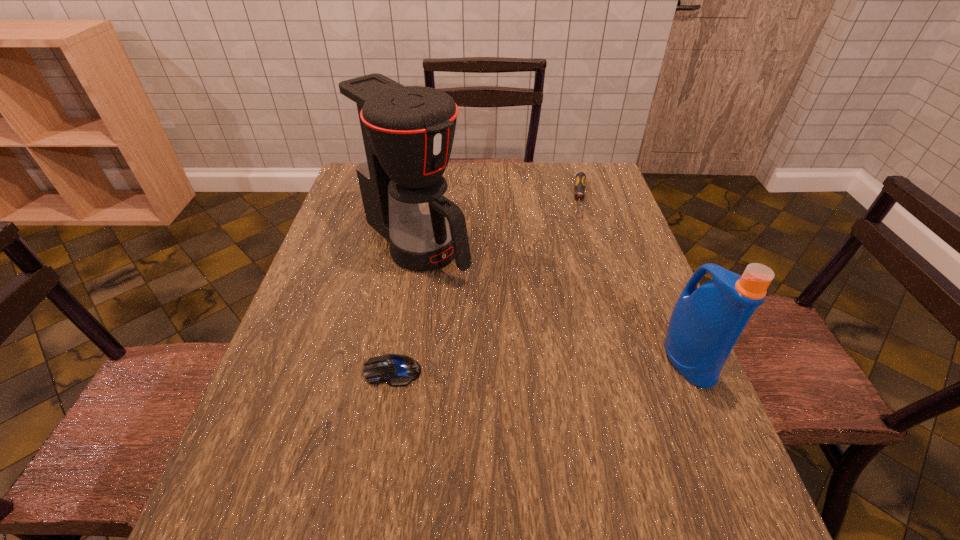
The image size is (960, 540). Identify the location of vacant region between the third object from left to right and the second tallest object. (635, 279).

The image size is (960, 540). Find the location of `free space between the computer mouse and the screwdriver`. free space between the computer mouse and the screwdriver is located at coordinates (487, 285).

You are a GUI agent. You are given a task and a screenshot of the screen. Output one action in this format:
    pyautogui.click(x=<x>, y=<y>)
    Task: Click on the free space between the third shortest object and the coffee maker
    
    Given the screenshot: What is the action you would take?
    pyautogui.click(x=552, y=301)

Identify the location of empty space between the tallest object and the third object from left to right. (498, 222).

Choose which object is the third nearest neighbor to the tallest object. Please provide its 2D coordinates. Your answer should be formatted as a tuple, i.e. [(x, y)], where the tuple contains the x and y coordinates of a point satisfying the conditions above.

[(706, 322)]

At what (x,y) coordinates should I click in order to perform the action: click on object that is the third closest to the tallest object. Please return your answer as a coordinate pair (x, y). Looking at the image, I should click on (706, 322).

The width and height of the screenshot is (960, 540). I want to click on free region that satisfies the following two spatial constraints: 1. on the back side of the coffee maker; 2. on the left side of the third object from left to right, so click(x=423, y=200).